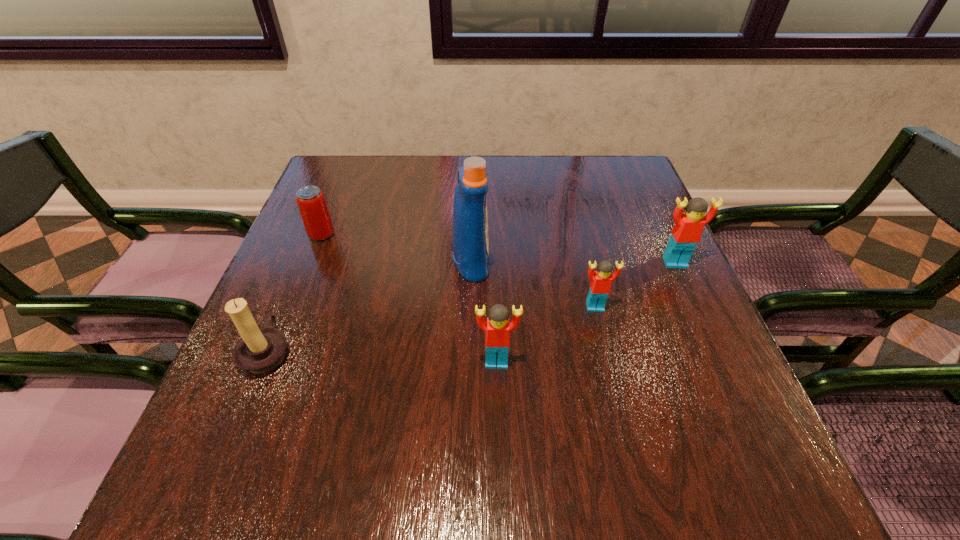
Find the location of a particular element. The width and height of the screenshot is (960, 540). the nearest Lego is located at coordinates (497, 335).

At what (x,y) coordinates should I click in order to perform the action: click on the second tallest Lego. Please return your answer as a coordinate pair (x, y). The image size is (960, 540). Looking at the image, I should click on (497, 335).

The height and width of the screenshot is (540, 960). What are the coordinates of `the third nearest object` in the screenshot? It's located at (601, 280).

Find the location of a particular element. the shortest Lego is located at coordinates (601, 280).

Identify the location of the rightmost object. (686, 233).

The height and width of the screenshot is (540, 960). I want to click on the rightmost Lego, so click(x=686, y=233).

The image size is (960, 540). I want to click on beer can, so click(311, 202).

Where is `detergent`? The width and height of the screenshot is (960, 540). detergent is located at coordinates (470, 243).

The image size is (960, 540). In order to click on candle holder in this screenshot , I will do `click(260, 350)`.

Find the location of a particular element. This screenshot has width=960, height=540. free space located 0.070m on the face of the second tallest Lego is located at coordinates (498, 404).